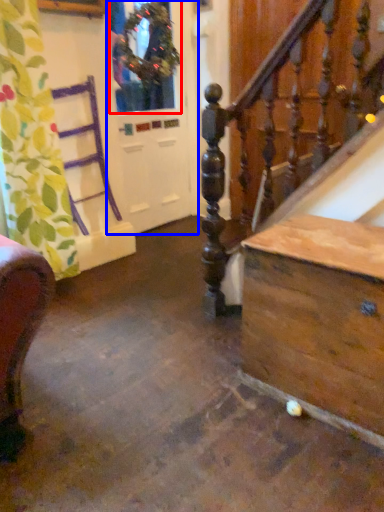
Question: Which of the following is the closest to the observer, window (highlighted by a red box) or screen door (highlighted by a blue box)?

Choices:
 (A) window
 (B) screen door

Answer: (A)